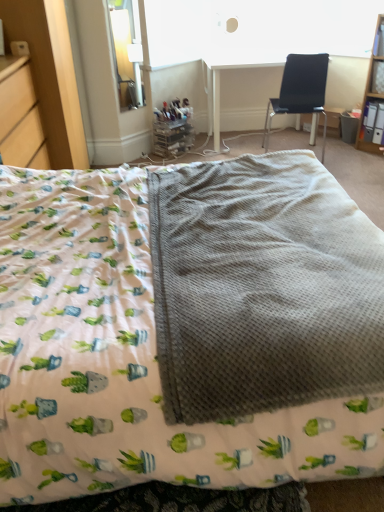
Question: From a real-world perspective, is white plastic table at upper center physically below clear glass window screen at upper left?

Choices:
 (A) yes
 (B) no

Answer: (A)

Question: Is white plastic table at upper center to the left of clear glass window screen at upper left from the viewer's perspective?

Choices:
 (A) no
 (B) yes

Answer: (A)

Question: Is white plastic table at upper center touching clear glass window screen at upper left?

Choices:
 (A) no
 (B) yes

Answer: (A)

Question: Is white plastic table at upper center facing towards clear glass window screen at upper left?

Choices:
 (A) no
 (B) yes

Answer: (A)

Question: From the image's perspective, would you say white plastic table at upper center is positioned over clear glass window screen at upper left?

Choices:
 (A) yes
 (B) no

Answer: (B)

Question: Considering the relative positions of waffle-textured blanket at center and gray waffle-textured blanket at center in the image provided, is waffle-textured blanket at center to the left or to the right of gray waffle-textured blanket at center?

Choices:
 (A) left
 (B) right

Answer: (A)

Question: Considering the positions of waffle-textured blanket at center and gray waffle-textured blanket at center in the image, is waffle-textured blanket at center bigger or smaller than gray waffle-textured blanket at center?

Choices:
 (A) big
 (B) small

Answer: (A)

Question: Considering the positions of waffle-textured blanket at center and gray waffle-textured blanket at center in the image, is waffle-textured blanket at center wider or thinner than gray waffle-textured blanket at center?

Choices:
 (A) wide
 (B) thin

Answer: (A)

Question: Considering their positions, is waffle-textured blanket at center located in front of or behind gray waffle-textured blanket at center?

Choices:
 (A) front
 (B) behind

Answer: (A)

Question: Is gray waffle-textured blanket at center in front of or behind black fabric chair at upper right in the image?

Choices:
 (A) front
 (B) behind

Answer: (A)

Question: Considering the positions of gray waffle-textured blanket at center and black fabric chair at upper right in the image, is gray waffle-textured blanket at center wider or thinner than black fabric chair at upper right?

Choices:
 (A) wide
 (B) thin

Answer: (A)

Question: From their relative heights in the image, would you say gray waffle-textured blanket at center is taller or shorter than black fabric chair at upper right?

Choices:
 (A) short
 (B) tall

Answer: (A)

Question: In terms of size, does gray waffle-textured blanket at center appear bigger or smaller than black fabric chair at upper right?

Choices:
 (A) small
 (B) big

Answer: (A)

Question: From the image's perspective, is black fabric chair at upper right positioned above or below clear glass window screen at upper left?

Choices:
 (A) below
 (B) above

Answer: (A)

Question: Considering the positions of black fabric chair at upper right and clear glass window screen at upper left in the image, is black fabric chair at upper right wider or thinner than clear glass window screen at upper left?

Choices:
 (A) wide
 (B) thin

Answer: (A)